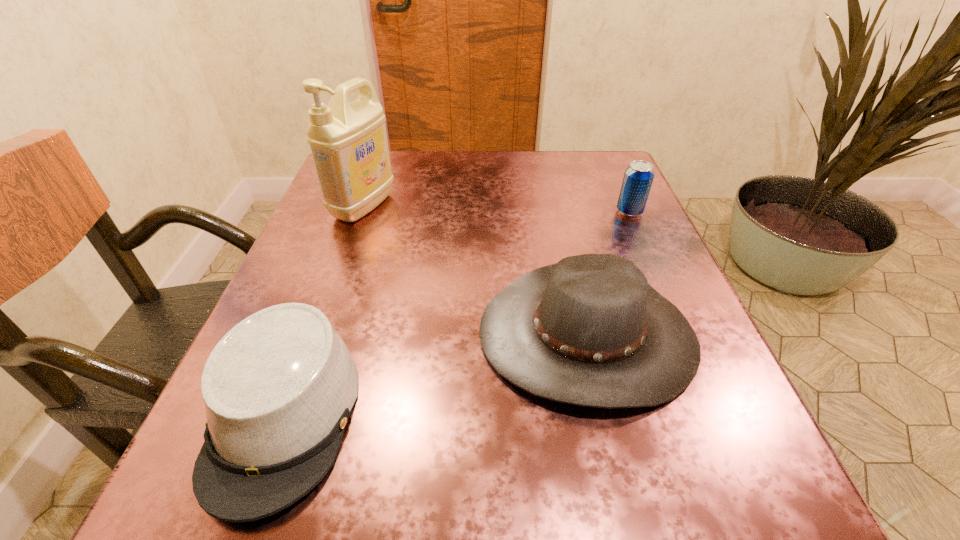
This screenshot has width=960, height=540. Identify the location of free space that satisfies the following two spatial constraints: 1. on the front side of the beer can; 2. on the left side of the detergent. (362, 212).